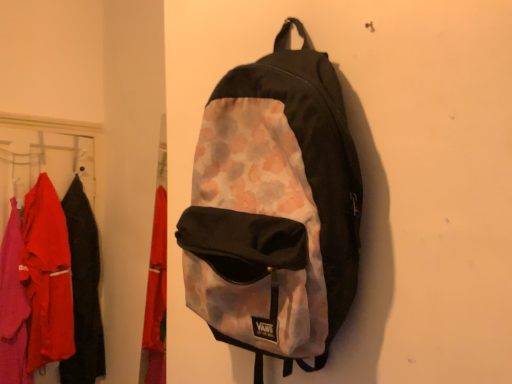
Question: Is matte fabric clothes at left positioned in front of watercolor-patterned fabric backpack at center?

Choices:
 (A) yes
 (B) no

Answer: (B)

Question: Does matte fabric clothes at left have a greater height compared to watercolor-patterned fabric backpack at center?

Choices:
 (A) no
 (B) yes

Answer: (B)

Question: Is matte fabric clothes at left smaller than watercolor-patterned fabric backpack at center?

Choices:
 (A) no
 (B) yes

Answer: (A)

Question: Does matte fabric clothes at left have a larger size compared to watercolor-patterned fabric backpack at center?

Choices:
 (A) no
 (B) yes

Answer: (B)

Question: Does matte fabric clothes at left turn towards watercolor-patterned fabric backpack at center?

Choices:
 (A) no
 (B) yes

Answer: (A)

Question: Considering their positions, is matte black jacket at left located in front of or behind matte fabric clothes at left?

Choices:
 (A) front
 (B) behind

Answer: (B)

Question: Looking at the image, does matte black jacket at left seem bigger or smaller compared to matte fabric clothes at left?

Choices:
 (A) small
 (B) big

Answer: (A)

Question: From a real-world perspective, is matte black jacket at left above or below matte fabric clothes at left?

Choices:
 (A) below
 (B) above

Answer: (A)

Question: Is matte black jacket at left inside or outside of matte fabric clothes at left?

Choices:
 (A) inside
 (B) outside

Answer: (A)

Question: Is matte fabric clothes at left situated inside watercolor-patterned fabric backpack at center or outside?

Choices:
 (A) inside
 (B) outside

Answer: (B)

Question: In the image, is matte fabric clothes at left positioned in front of or behind watercolor-patterned fabric backpack at center?

Choices:
 (A) front
 (B) behind

Answer: (B)

Question: From the image's perspective, is matte fabric clothes at left above or below watercolor-patterned fabric backpack at center?

Choices:
 (A) below
 (B) above

Answer: (A)

Question: In terms of size, does matte fabric clothes at left appear bigger or smaller than watercolor-patterned fabric backpack at center?

Choices:
 (A) big
 (B) small

Answer: (A)

Question: Is point (214, 248) positioned closer to the camera than point (7, 354)?

Choices:
 (A) farther
 (B) closer

Answer: (B)

Question: From the image's perspective, relative to matte fabric clothes at left, is watercolor-patterned fabric backpack at center above or below?

Choices:
 (A) above
 (B) below

Answer: (A)